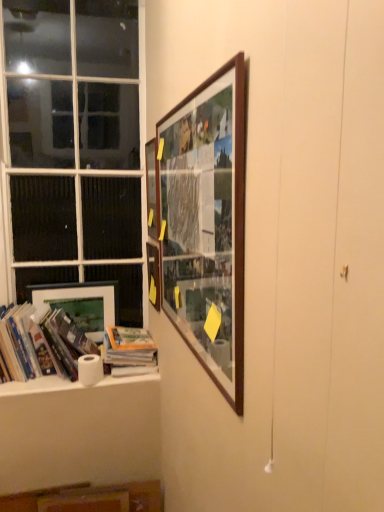
Locate an element on the screen. The height and width of the screenshot is (512, 384). vacant area that lies to the right of white matte toilet paper at lower left is located at coordinates (123, 377).